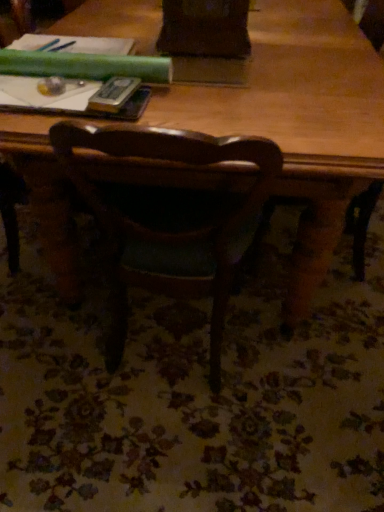
The width and height of the screenshot is (384, 512). Describe the element at coordinates (299, 121) in the screenshot. I see `wooden table at center` at that location.

You are a GUI agent. You are given a task and a screenshot of the screen. Output one action in this format:
    pyautogui.click(x=<x>, y=<y>)
    Task: Click on the hardcover book at upper left
    
    Given the screenshot: What is the action you would take?
    pyautogui.click(x=77, y=75)

Can you confirm if metallic silver paperback book at upper center is taller than hardcover book at upper left?

No, metallic silver paperback book at upper center is not taller than hardcover book at upper left.

Can you confirm if metallic silver paperback book at upper center is positioned to the right of hardcover book at upper left?

Correct, you'll find metallic silver paperback book at upper center to the right of hardcover book at upper left.

From the image's perspective, between metallic silver paperback book at upper center and hardcover book at upper left, who is located below?

metallic silver paperback book at upper center appears lower in the image.

Is metallic silver paperback book at upper center inside or outside of hardcover book at upper left?

metallic silver paperback book at upper center lies outside hardcover book at upper left.

Which object is more forward, hardcover book at upper left or metallic silver paperback book at upper center?

metallic silver paperback book at upper center is more forward.

Who is taller, hardcover book at upper left or metallic silver paperback book at upper center?

hardcover book at upper left.

Based on the photo, does hardcover book at upper left have a greater width compared to metallic silver paperback book at upper center?

Yes, hardcover book at upper left is wider than metallic silver paperback book at upper center.

In the image, there is a metallic silver paperback book at upper center. Where is `table below it (from a real-world perspective)`? table below it (from a real-world perspective) is located at coordinates (299, 121).

Is wooden table at center oriented towards metallic silver paperback book at upper center?

No, wooden table at center is not aimed at metallic silver paperback book at upper center.

Is the surface of wooden table at center in direct contact with metallic silver paperback book at upper center?

There is a gap between wooden table at center and metallic silver paperback book at upper center.

Which of these two, wooden table at center or metallic silver paperback book at upper center, is wider?

With larger width is wooden table at center.

Is hardcover book at upper left inside wooden table at center?

Yes, hardcover book at upper left is a part of wooden table at center.

Can you confirm if wooden table at center is thinner than hardcover book at upper left?

No, wooden table at center is not thinner than hardcover book at upper left.

Is wooden table at center at the right side of hardcover book at upper left?

Yes.

From the picture: Could you tell me if wooden table at center is turned towards hardcover book at upper left?

No, wooden table at center does not turn towards hardcover book at upper left.

The height and width of the screenshot is (512, 384). In order to click on table in front of the hardcover book at upper left in this screenshot , I will do `click(299, 121)`.

Is hardcover book at upper left aimed at wooden table at center?

No, hardcover book at upper left does not turn towards wooden table at center.

What's the angular difference between hardcover book at upper left and wooden table at center's facing directions?

The facing directions of hardcover book at upper left and wooden table at center are 180 degrees apart.

Which object is closer to the camera, metallic silver paperback book at upper center or wooden table at center?

wooden table at center is more forward.

Could you tell me if metallic silver paperback book at upper center is facing wooden table at center?

No.

From a real-world perspective, which object stands above the other?

metallic silver paperback book at upper center, from a real-world perspective.

What's the angular difference between metallic silver paperback book at upper center and wooden table at center's facing directions?

The angular difference between metallic silver paperback book at upper center and wooden table at center is 6.53 degrees.

The image size is (384, 512). Find the location of `book behind the metallic silver paperback book at upper center`. book behind the metallic silver paperback book at upper center is located at coordinates (77, 75).

Identify the location of paperback book on the right of hardcover book at upper left. (113, 94).

From the image, which object appears to be nearer to hardcover book at upper left, metallic silver paperback book at upper center or wooden table at center?

Among the two, metallic silver paperback book at upper center is located nearer to hardcover book at upper left.

Consider the image. Based on their spatial positions, is wooden table at center or hardcover book at upper left further from metallic silver paperback book at upper center?

wooden table at center is further to metallic silver paperback book at upper center.

Looking at the image, which one is located further to wooden table at center, metallic silver paperback book at upper center or hardcover book at upper left?

metallic silver paperback book at upper center is positioned further to the anchor wooden table at center.

Based on the photo, considering their positions, is hardcover book at upper left positioned closer to metallic silver paperback book at upper center than wooden table at center?

hardcover book at upper left lies closer to metallic silver paperback book at upper center than the other object.

Based on their spatial positions, is hardcover book at upper left or metallic silver paperback book at upper center closer to wooden table at center?

Among the two, hardcover book at upper left is located nearer to wooden table at center.

Consider the image. Which object lies further to the anchor point hardcover book at upper left, wooden table at center or metallic silver paperback book at upper center?

wooden table at center is positioned further to the anchor hardcover book at upper left.

You are a GUI agent. You are given a task and a screenshot of the screen. Output one action in this format:
    pyautogui.click(x=<x>, y=<y>)
    Task: Click on the paperback book located between hardcover book at upper left and wooden table at center in the left-right direction
    
    Given the screenshot: What is the action you would take?
    pyautogui.click(x=113, y=94)